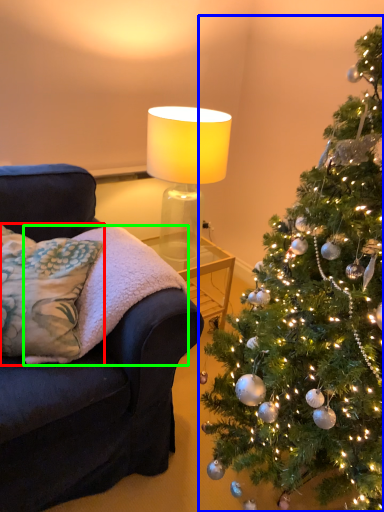
Question: Which object is positioned farthest from pillow (highlighted by a red box)? Select from christmas tree (highlighted by a blue box) and blanket (highlighted by a green box).

Choices:
 (A) christmas tree
 (B) blanket

Answer: (A)